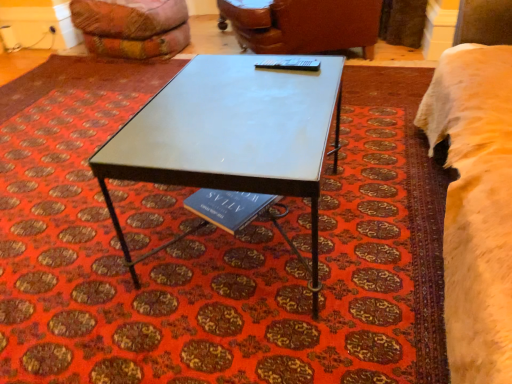
The width and height of the screenshot is (512, 384). What are the coordinates of `vacant space in front of metallic gray table at center` in the screenshot? It's located at (251, 335).